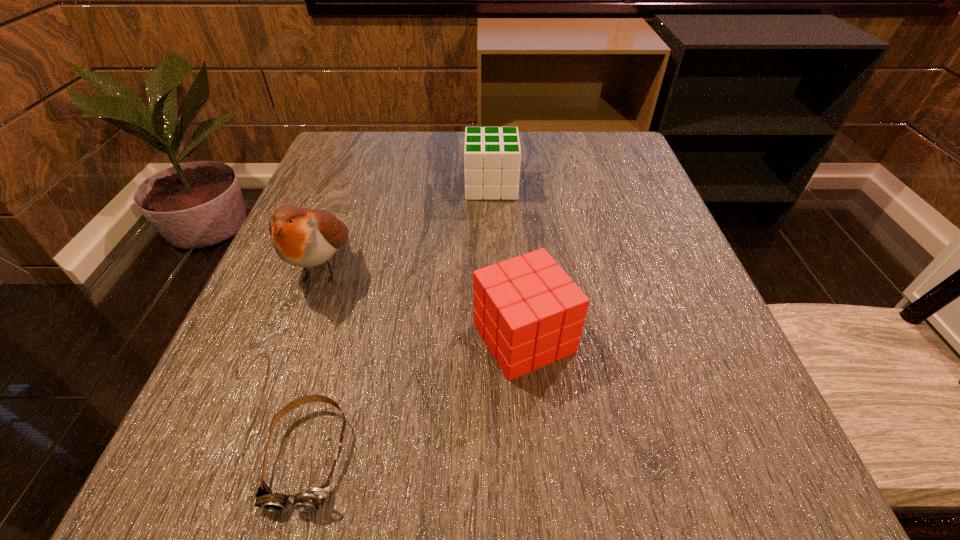
This screenshot has width=960, height=540. I want to click on the tallest object, so click(x=303, y=237).

Identify the location of the nearer cube. (528, 310).

Locate an element on the screen. This screenshot has height=540, width=960. the farthest object is located at coordinates (492, 156).

Locate an element on the screen. This screenshot has height=540, width=960. the shortest object is located at coordinates (314, 498).

Locate an element on the screen. Image resolution: width=960 pixels, height=540 pixels. goggles is located at coordinates (314, 498).

I want to click on free space located 0.130m at the face of the bird, so click(x=281, y=382).

This screenshot has width=960, height=540. Find the location of `free space located 0.120m on the left of the nearer cube`. free space located 0.120m on the left of the nearer cube is located at coordinates (394, 338).

The image size is (960, 540). I want to click on blank space located 0.250m on the red face of the farthest object, so pyautogui.click(x=349, y=186).

Locate an element on the screen. vacant space located 0.300m on the red face of the farthest object is located at coordinates (326, 186).

Where is `free spot located on the red face of the farthest object`? This screenshot has height=540, width=960. free spot located on the red face of the farthest object is located at coordinates (364, 186).